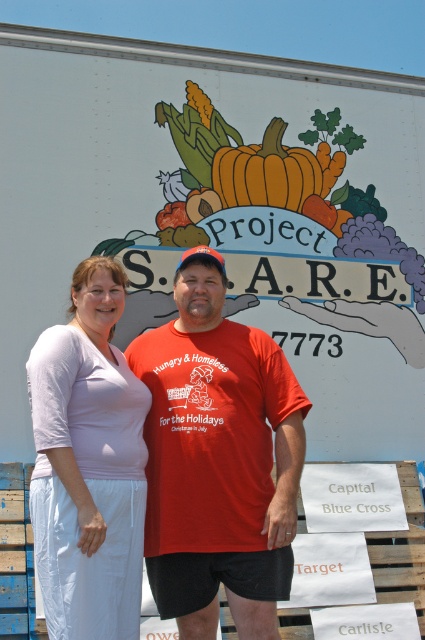
You are a photographer standing in front of the trailer and want to take a photo of both the pale pink fabric shirt at center and the orange matte pumpkin at center. Which object will appear larger in the photo?

The pale pink fabric shirt at center will appear larger in the photo because it is closer to the viewer than the orange matte pumpkin at center.